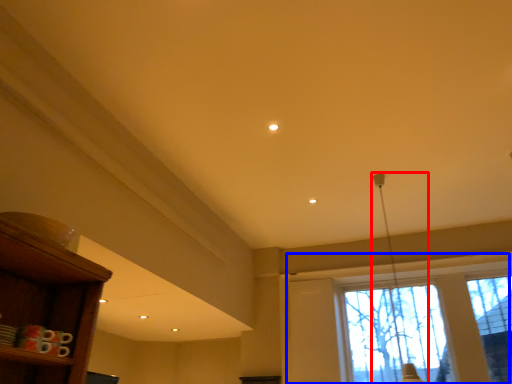
Question: Among these objects, which one is farthest to the camera, lamp (highlighted by a red box) or window (highlighted by a blue box)?

Choices:
 (A) lamp
 (B) window

Answer: (B)